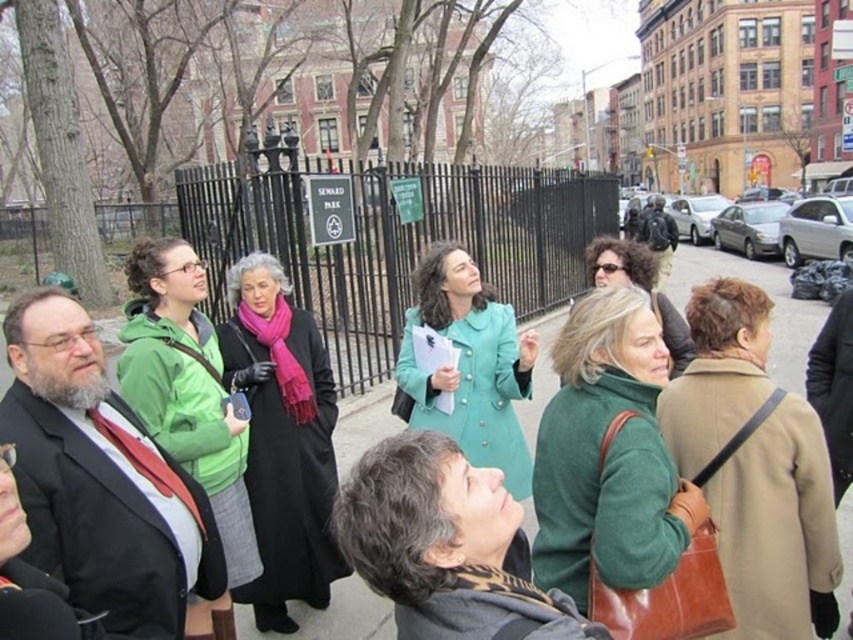
Which of these two, green matte jacket at center or teal fabric coat at center, stands shorter?

With less height is teal fabric coat at center.

This screenshot has width=853, height=640. Describe the element at coordinates (186, 388) in the screenshot. I see `green matte jacket at center` at that location.

This screenshot has width=853, height=640. What do you see at coordinates (186, 388) in the screenshot? I see `green matte jacket at center` at bounding box center [186, 388].

This screenshot has height=640, width=853. What are the coordinates of `green matte jacket at center` in the screenshot? It's located at (186, 388).

Can you confirm if green matte sweater at center is positioned to the left of pavement at center?

Correct, you'll find green matte sweater at center to the left of pavement at center.

Who is positioned more to the left, green matte sweater at center or pavement at center?

From the viewer's perspective, green matte sweater at center appears more on the left side.

You are a GUI agent. You are given a task and a screenshot of the screen. Output one action in this format:
    pyautogui.click(x=<x>, y=<y>)
    Task: Click on the green matte sweater at center
    Image resolution: width=853 pixels, height=640 pixels.
    Given the screenshot: What is the action you would take?
    pyautogui.click(x=613, y=472)

Can you confirm if green matte sweater at center is wider than green matte jacket at center?

In fact, green matte sweater at center might be narrower than green matte jacket at center.

Does green matte sweater at center have a larger size compared to green matte jacket at center?

No.

Is point (660, 541) behind point (195, 259)?

That is False.

Identify the location of green matte sweater at center. (613, 472).